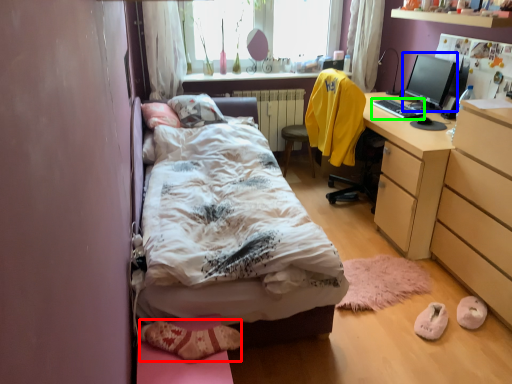
Question: Based on their relative distances, which object is nearer to shoe (highlighted by a red box)? Choose from computer monitor (highlighted by a blue box) and desktop (highlighted by a green box).

Choices:
 (A) computer monitor
 (B) desktop

Answer: (B)